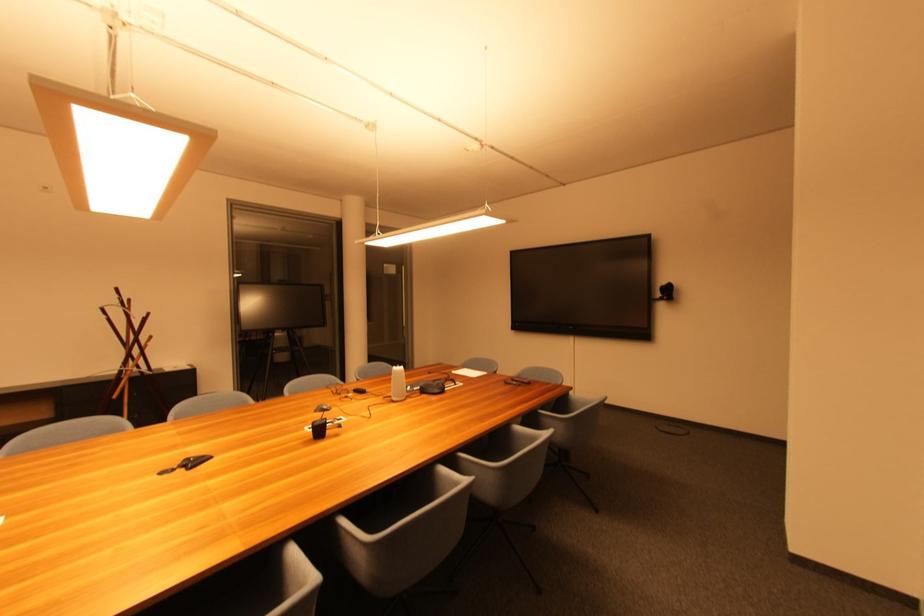
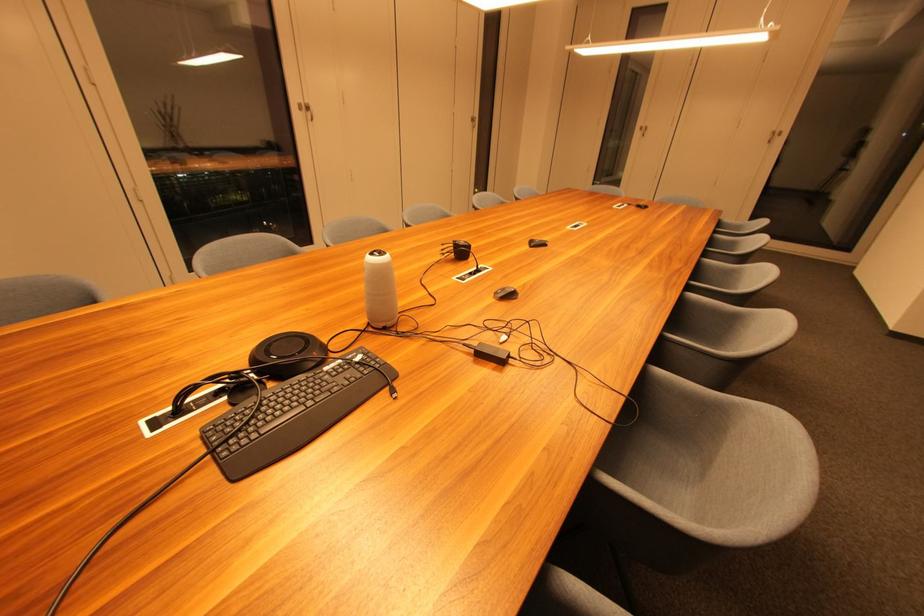
In the second image, find the point that corresponds to pixel 424 389 in the first image.

(332, 371)